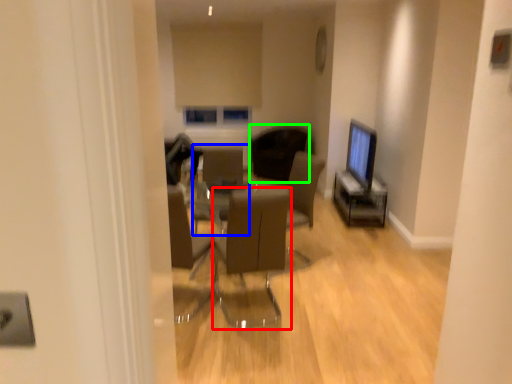
Question: Considering the real-world distances, which object is closest to chair (highlighted by a red box)? armchair (highlighted by a blue box) or chair (highlighted by a green box).

Choices:
 (A) armchair
 (B) chair

Answer: (A)